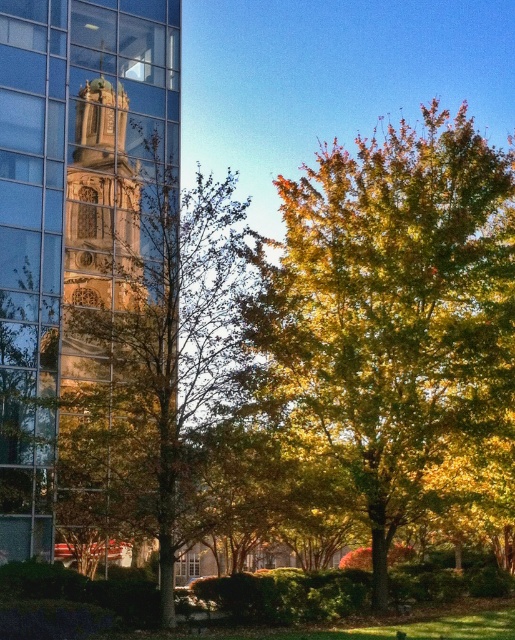
Can you confirm if golden-green leafy tree at center-right is bigger than golden glass tower at left?

Correct, golden-green leafy tree at center-right is larger in size than golden glass tower at left.

Where is `golden-green leafy tree at center-right`? This screenshot has height=640, width=515. golden-green leafy tree at center-right is located at coordinates (393, 310).

Is golden glass tower at left closer to the viewer compared to green leafy tree at center?

No, golden glass tower at left is behind green leafy tree at center.

Consider the image. Can you confirm if golden glass tower at left is wider than green leafy tree at center?

In fact, golden glass tower at left might be narrower than green leafy tree at center.

Identify the location of golden glass tower at left. (73, 218).

Locate an element on the screen. golden glass tower at left is located at coordinates (73, 218).

Does golden-green leafy tree at center-right appear over green leafy tree at center?

Correct, golden-green leafy tree at center-right is located above green leafy tree at center.

Can you confirm if golden-green leafy tree at center-right is positioned to the left of green leafy tree at center?

No, golden-green leafy tree at center-right is not to the left of green leafy tree at center.

Which is behind, point (293, 358) or point (185, 468)?

The point (293, 358) is behind.

Where is `golden-green leafy tree at center-right`? This screenshot has width=515, height=640. golden-green leafy tree at center-right is located at coordinates (393, 310).